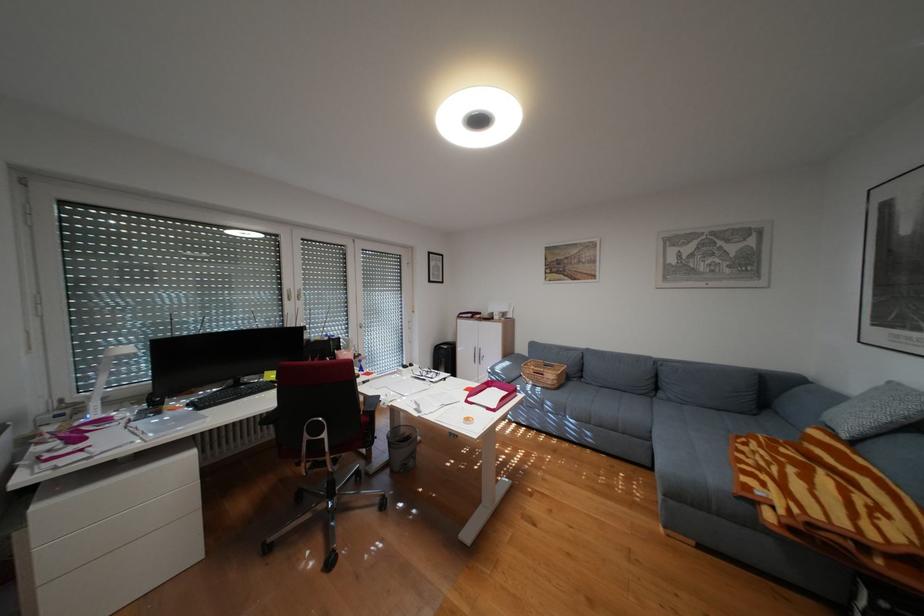
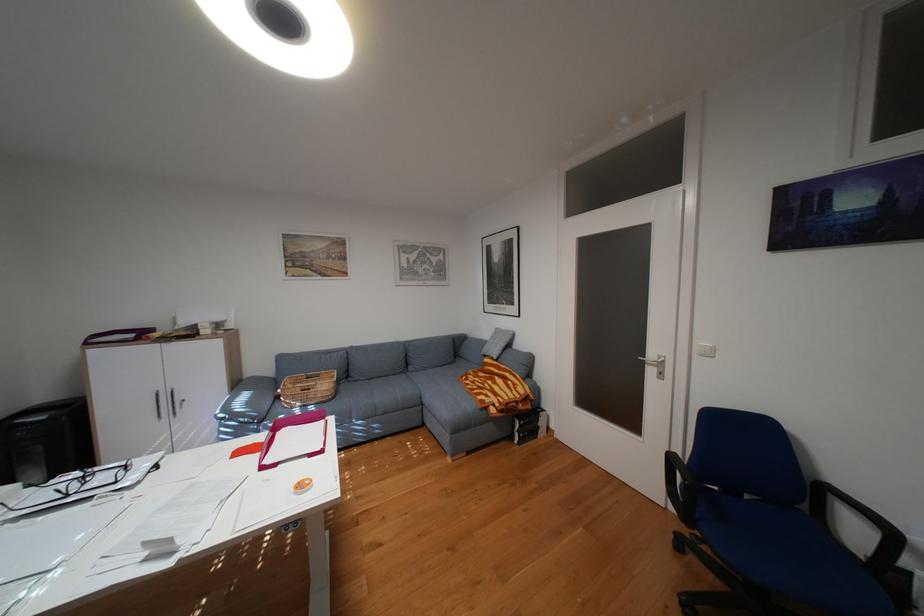
Question: I am providing you with two images of the same scene from different viewpoints. After the viewpoint changes to image2, which objects are now occluded?

Choices:
 (A) wicker basket
 (B) black chair armrest
 (C) white light switch
 (D) none of these

Answer: (D)